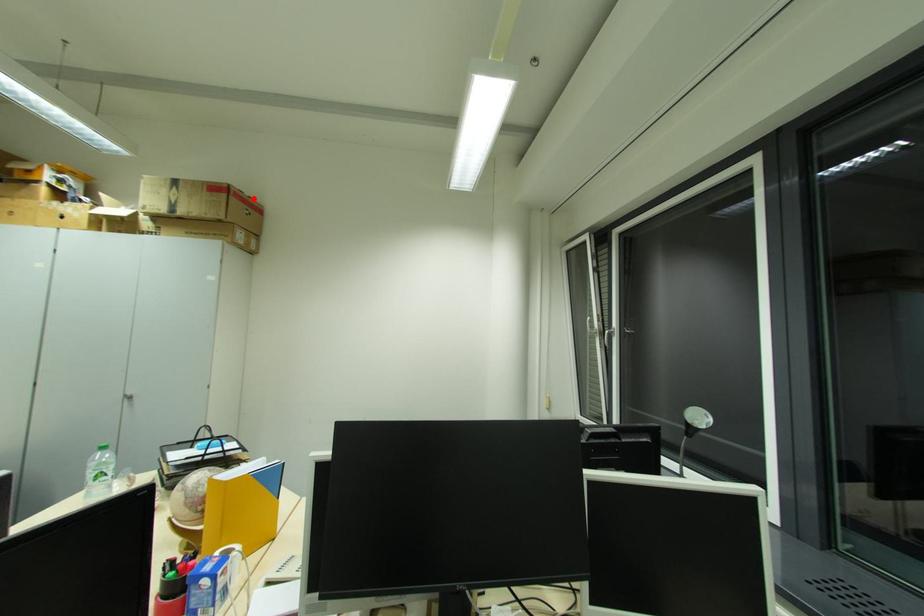
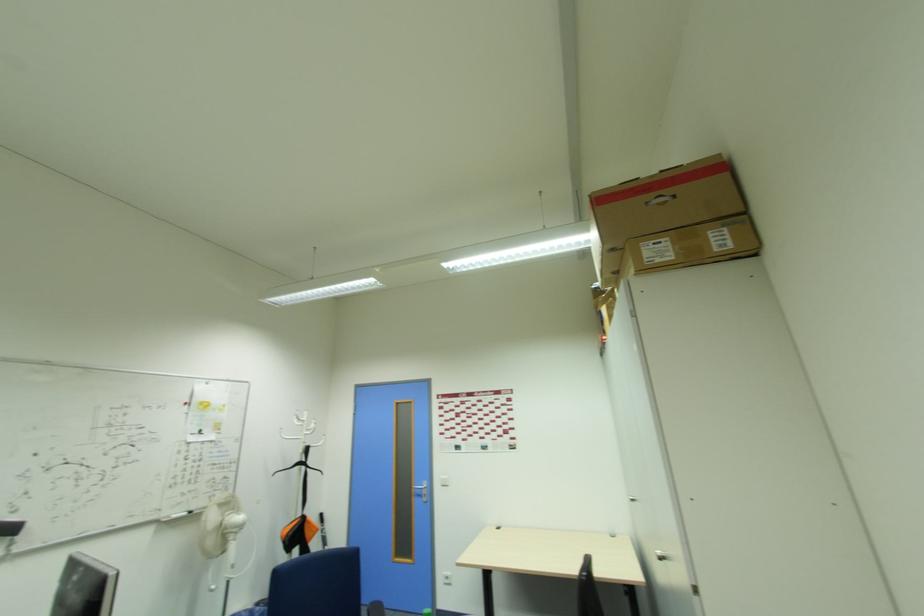
The point at the highlighted location is marked in the first image. Where is the corresponding point in the second image?

(665, 172)